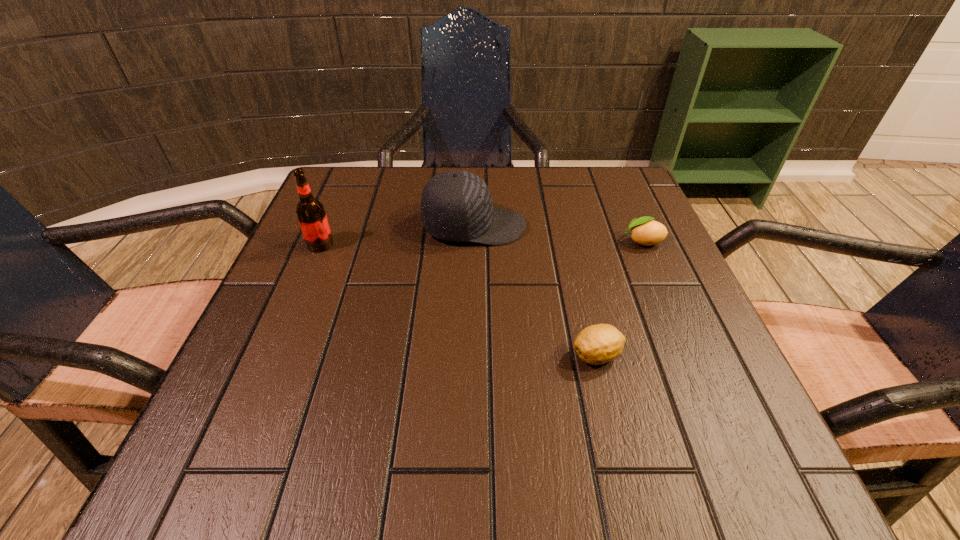
The image size is (960, 540). Find the location of `the leftmost object`. the leftmost object is located at coordinates (310, 212).

Where is `the tallest object`? the tallest object is located at coordinates (310, 212).

The image size is (960, 540). I want to click on the second tallest object, so click(x=456, y=205).

I want to click on the second object from left to right, so click(x=456, y=205).

Identify the location of the nearest object. The image size is (960, 540). (598, 344).

Find the location of a particular element. the left lemon is located at coordinates (598, 344).

This screenshot has width=960, height=540. I want to click on the rightmost object, so click(x=644, y=231).

The width and height of the screenshot is (960, 540). What are the coordinates of `the right lemon` in the screenshot? It's located at (644, 231).

Identify the location of vacant space situated on the front of the leftmost object. The width and height of the screenshot is (960, 540). (255, 400).

At what (x,y) coordinates should I click in order to perform the action: click on vacant region located 0.150m at the front of the third object from right to left where the brim is located. Please return your answer as a coordinate pair (x, y). This screenshot has height=540, width=960. Looking at the image, I should click on (597, 226).